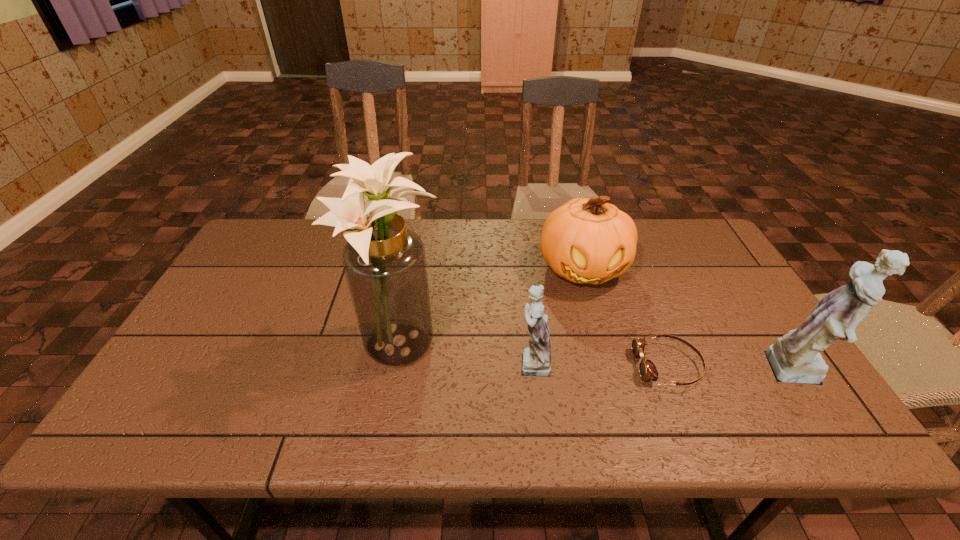
Identify the location of free space for a new figurine on the left. (273, 352).